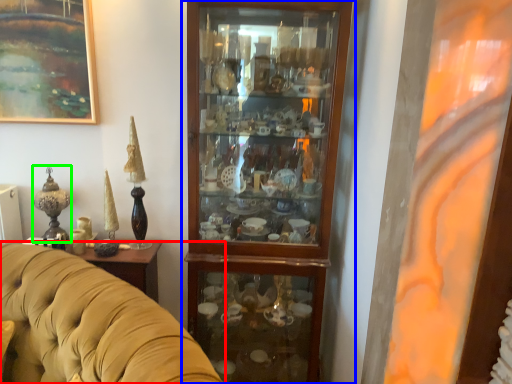
Question: Considering the real-world distances, which object is closest to studio couch (highlighted by a red box)? cupboard (highlighted by a blue box) or candle holder (highlighted by a green box).

Choices:
 (A) cupboard
 (B) candle holder

Answer: (B)